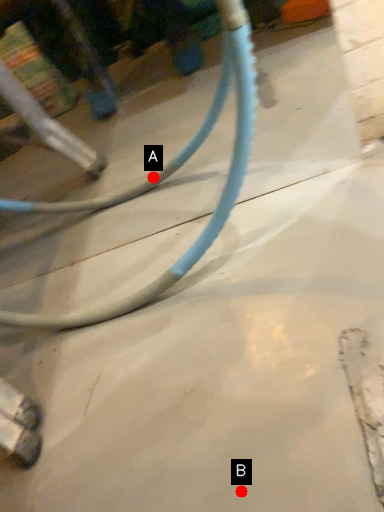
Question: Two points are circled on the image, labeled by A and B beside each circle. Which point is closer to the camera?

Choices:
 (A) A is closer
 (B) B is closer

Answer: (B)